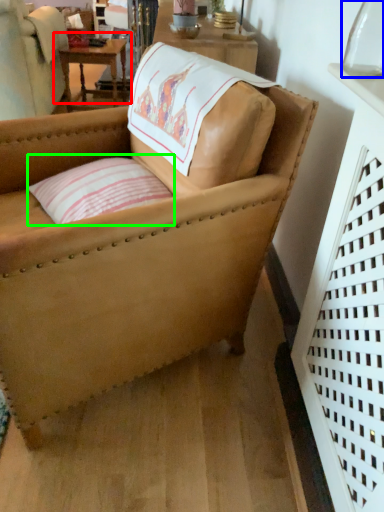
Question: Based on their relative distances, which object is farther from table (highlighted by a red box)? Choose from glass vase (highlighted by a blue box) and pillow (highlighted by a green box).

Choices:
 (A) glass vase
 (B) pillow

Answer: (A)